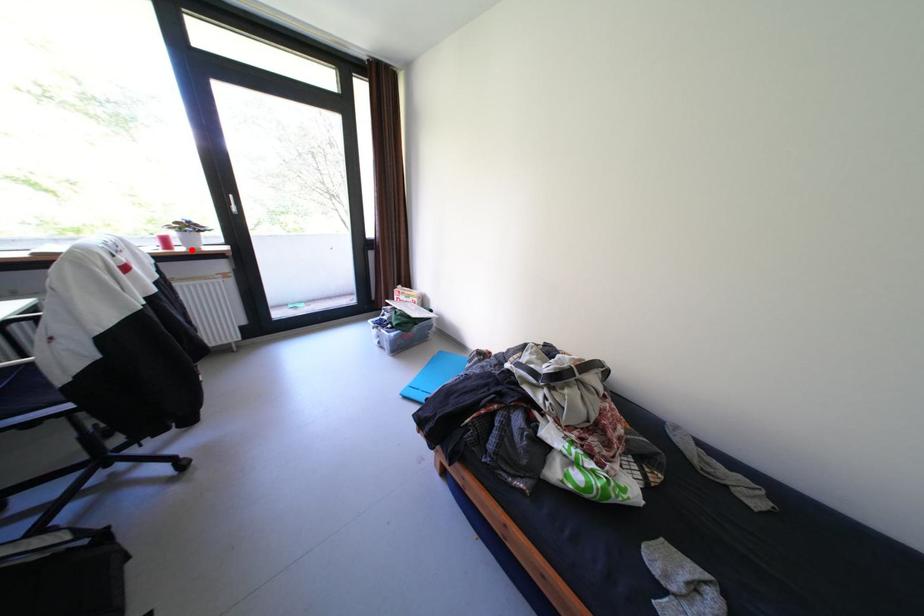
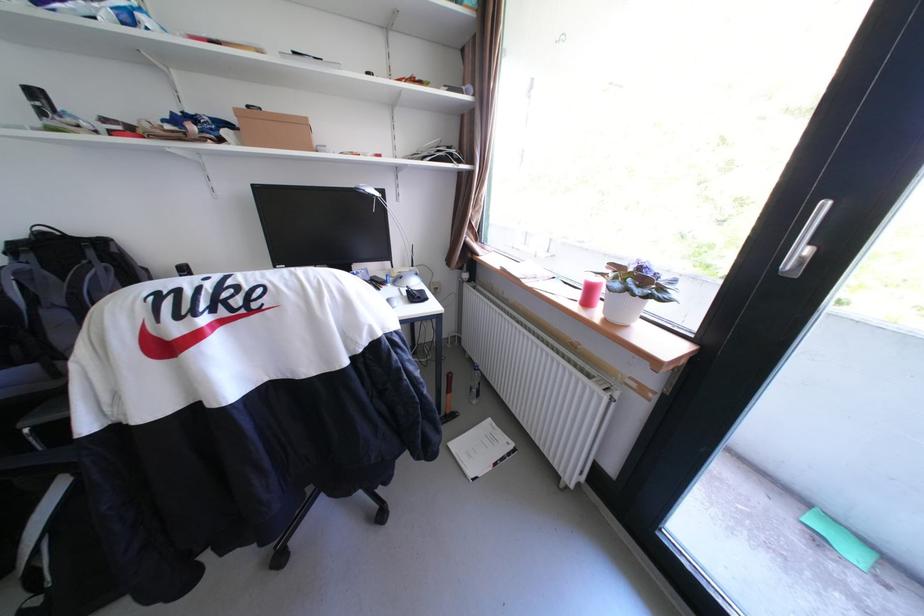
Find the pixel in the second image that matches the highlighted location in the first image.

(608, 313)